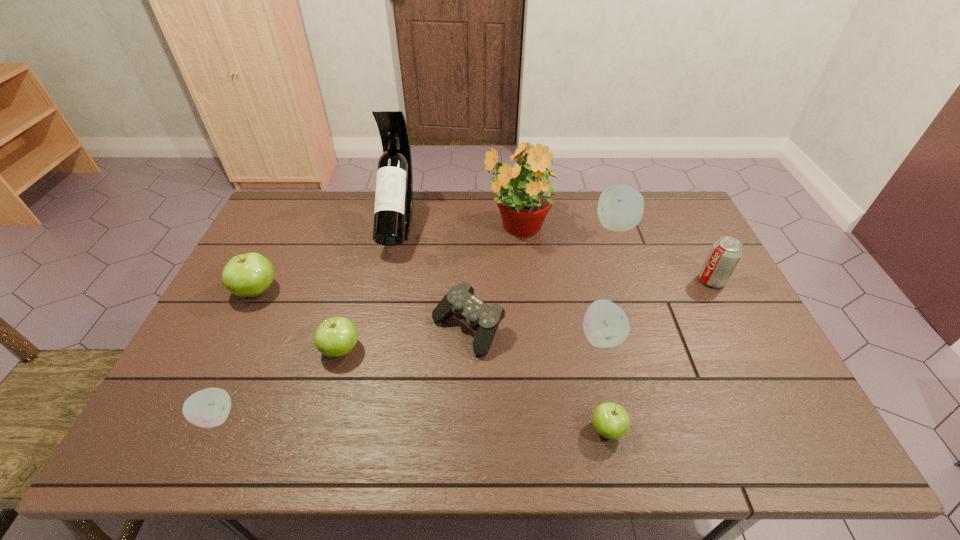
Where is `black wine bottle`? black wine bottle is located at coordinates (393, 209).

This screenshot has width=960, height=540. Identify the location of red flowerpot. click(x=523, y=189).

At what (x,y) coordinates should I click in order to perform the action: click on the ninth object from left to right. Please return your answer as a coordinate pair (x, y). The height and width of the screenshot is (540, 960). Looking at the image, I should click on (620, 208).

Locate an element on the screen. This screenshot has height=540, width=960. the biggest white apple is located at coordinates (620, 208).

In order to click on the farthest green apple in this screenshot , I will do `click(247, 275)`.

Locate an element on the screen. The height and width of the screenshot is (540, 960). the second farthest apple is located at coordinates (247, 275).

The width and height of the screenshot is (960, 540). What are the coordinates of `gray soda can` in the screenshot? It's located at (725, 253).

I want to click on the rightmost object, so click(725, 253).

The image size is (960, 540). Identify the location of the second white apple from right to left. (605, 325).

Where is `the second farthest white apple`? The height and width of the screenshot is (540, 960). the second farthest white apple is located at coordinates (605, 325).